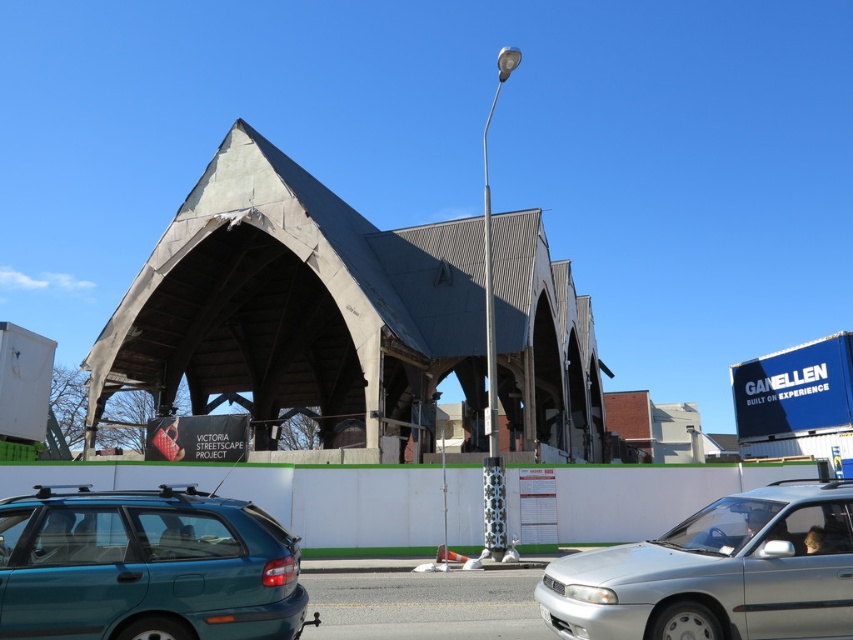
Is teal matte hatchback at lower left in front of silver metallic sedan at center?

That is True.

How far apart are teal matte hatchback at lower left and silver metallic sedan at center?

A distance of 3.32 meters exists between teal matte hatchback at lower left and silver metallic sedan at center.

Is point (218, 528) less distant than point (762, 593)?

That is True.

I want to click on teal matte hatchback at lower left, so click(144, 566).